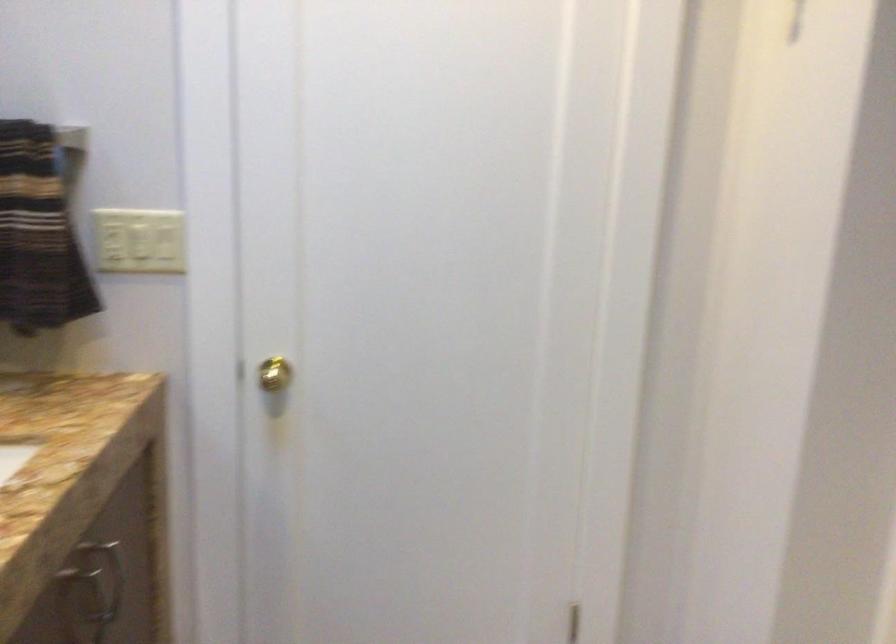
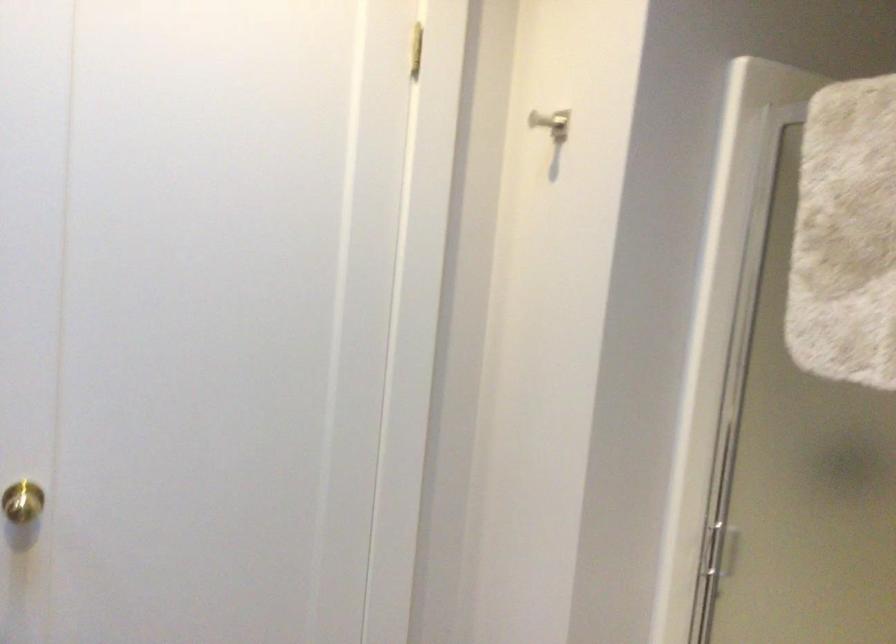
Question: The camera is either moving clockwise (left) or counter-clockwise (right) around the object. The first image is from the beginning of the video and the second image is from the end. Is the camera moving left or right when shooting the video?

Choices:
 (A) Left
 (B) Right

Answer: (A)